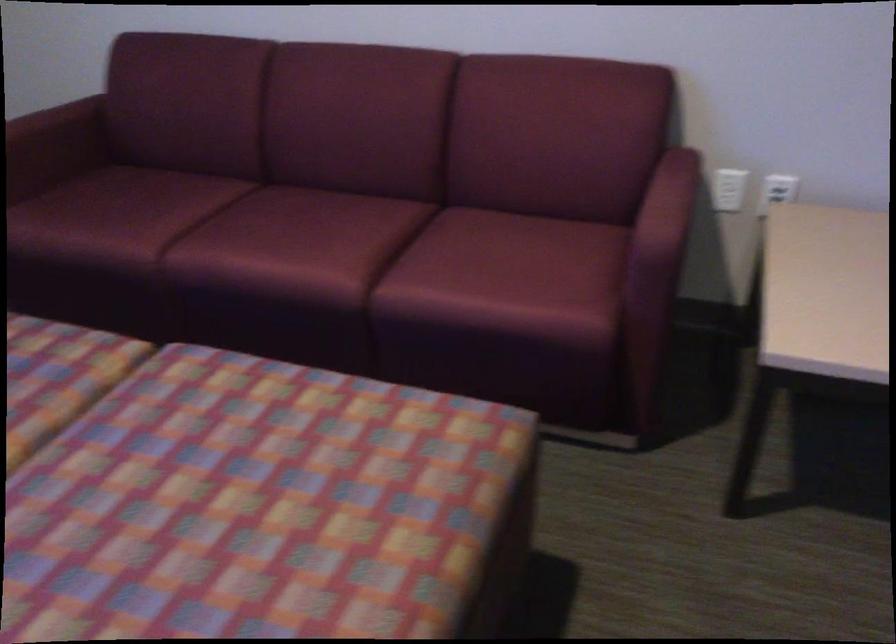
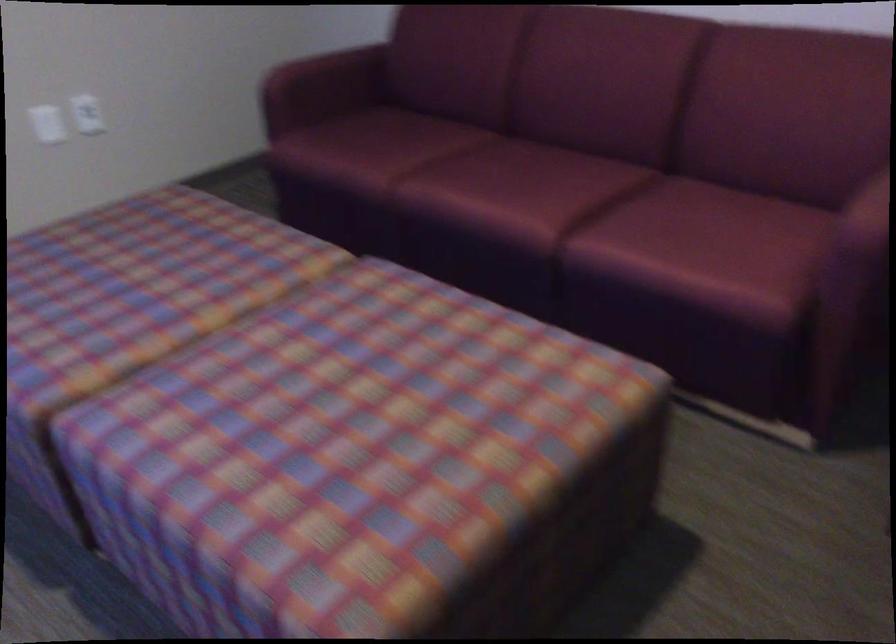
Question: How did the camera likely rotate?

Choices:
 (A) Left
 (B) Right
 (C) Up
 (D) Down

Answer: (A)